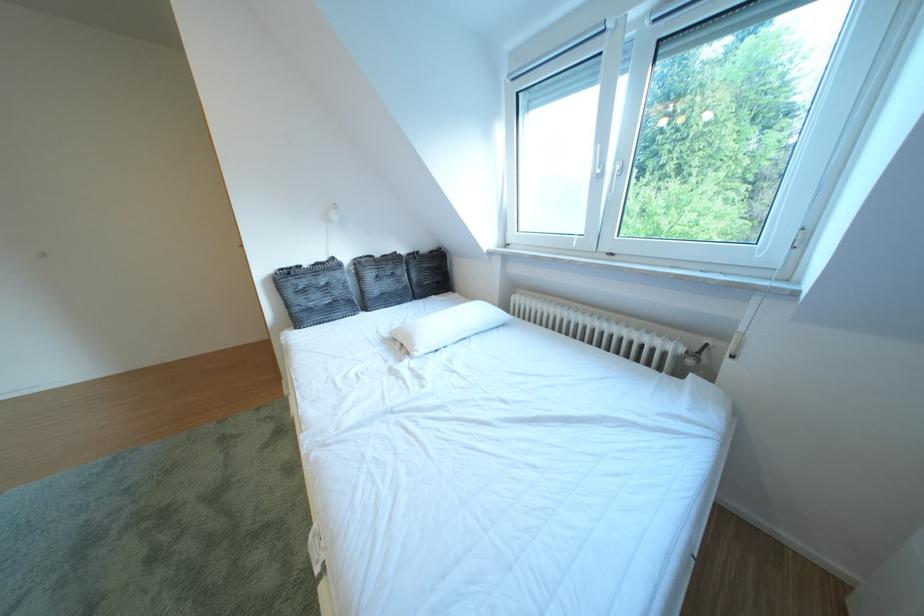
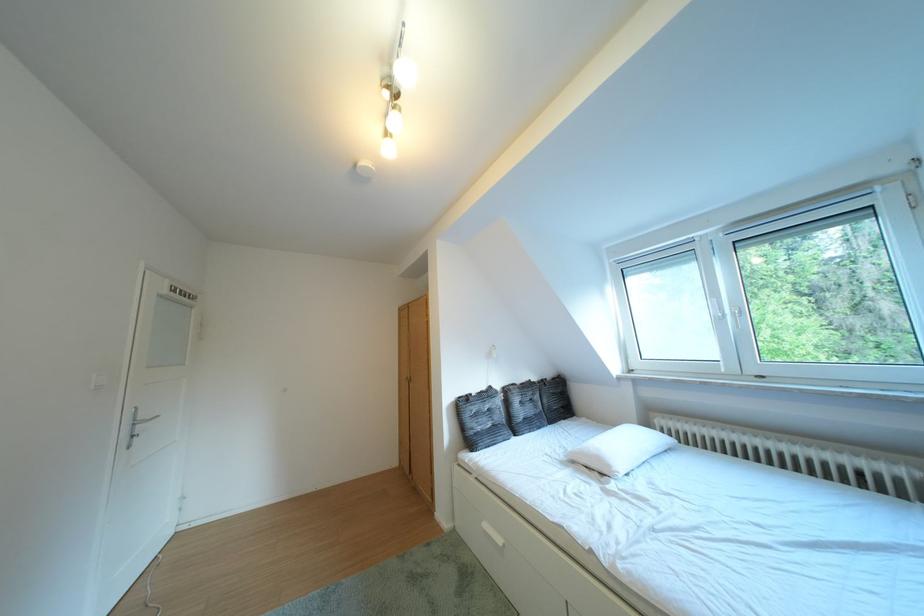
Find the pixel in the second image that matches (x=310, y=314) in the first image.

(484, 438)